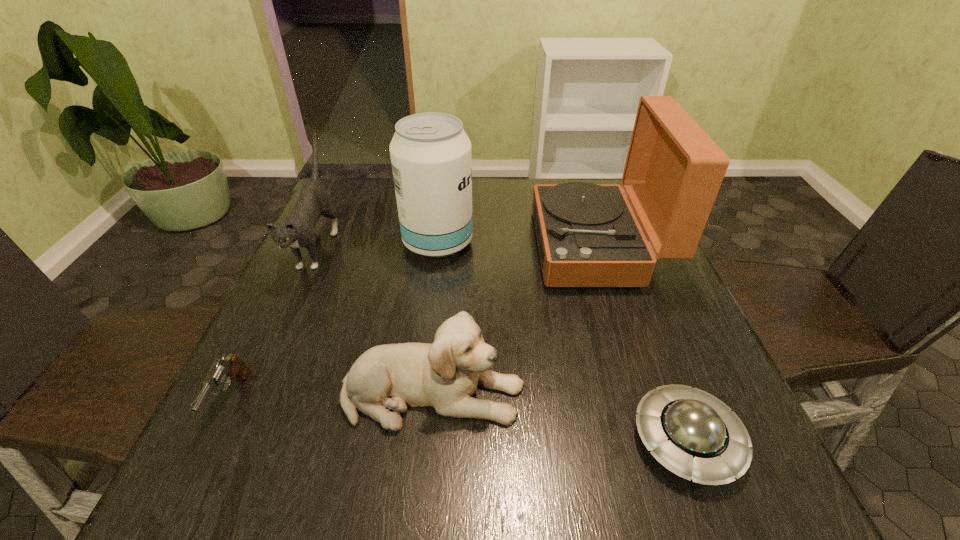
Image resolution: width=960 pixels, height=540 pixels. In order to click on vacant area that lies between the third shortest object and the alcohol in this screenshot , I will do `click(436, 318)`.

This screenshot has width=960, height=540. I want to click on unoccupied position between the fourth shortest object and the alcohol, so click(377, 244).

Find the location of a particular element. This screenshot has width=960, height=540. vacant point located between the alcohol and the third tallest object is located at coordinates (377, 244).

The height and width of the screenshot is (540, 960). I want to click on vacant space that is in between the cat and the fourth tallest object, so click(x=375, y=320).

Find the location of a particular element. unoccupied area between the saucer and the second shortest object is located at coordinates (459, 420).

You are a GUI agent. You are given a task and a screenshot of the screen. Output one action in this format:
    pyautogui.click(x=<x>, y=<y>)
    Task: Click on the free point between the second shortest object and the shortest object
    
    Given the screenshot: What is the action you would take?
    pyautogui.click(x=459, y=420)

Locate an element on the screen. The image size is (960, 540). vacant space that's between the phonograph record and the saucer is located at coordinates (642, 343).

The image size is (960, 540). In order to click on unoccupied area between the puppy and the pistol in this screenshot , I will do `click(332, 397)`.

Find the location of a particular element. unoccupied position between the phonograph record and the second shortest object is located at coordinates (414, 323).

This screenshot has width=960, height=540. I want to click on empty location between the shortest object and the pistol, so click(459, 420).